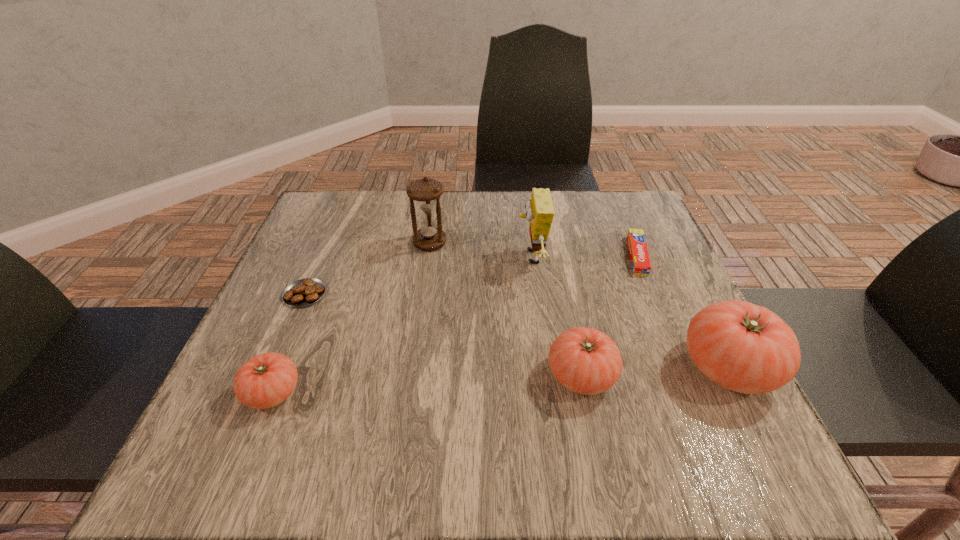
Please determine a free point for an extra tomato to ensure balance. Please provide its 2D coordinates. Your answer should be formatted as a tuple, i.e. [(x, y)], where the tuple contains the x and y coordinates of a point satisfying the conditions above.

[(430, 384)]